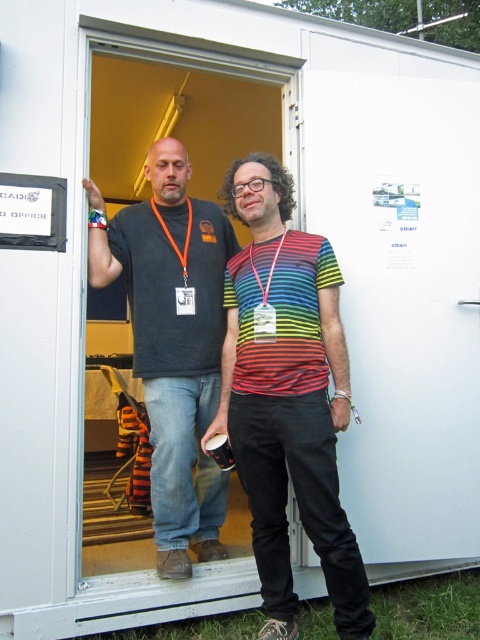
Describe the element at coordinates (288, 397) in the screenshot. I see `rainbow striped shirt at center` at that location.

Does point (277, 557) come closer to viewer compared to point (189, 232)?

Yes.

Image resolution: width=480 pixels, height=640 pixels. In order to click on rainbow striped shirt at center in this screenshot , I will do `click(288, 397)`.

The image size is (480, 640). I want to click on dark gray t-shirt at center, so pyautogui.click(x=172, y=342).

Can you confirm if dark gray t-shirt at center is positioned below orange fabric lanyard at center?

Yes.

The height and width of the screenshot is (640, 480). What do you see at coordinates (172, 342) in the screenshot?
I see `dark gray t-shirt at center` at bounding box center [172, 342].

Identify the location of dark gray t-shirt at center. The image size is (480, 640). (172, 342).

Is rainbow striped shirt at center shorter than dark gray t-shirt at center?

Yes, rainbow striped shirt at center is shorter than dark gray t-shirt at center.

Between point (328, 364) and point (177, 396), which one is positioned in front?

Positioned in front is point (328, 364).

Identify the location of rainbow striped shirt at center. This screenshot has height=640, width=480. (288, 397).